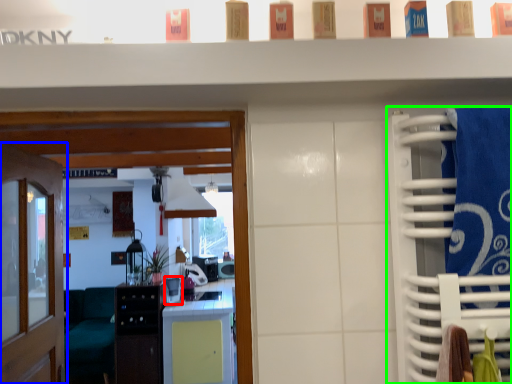
Question: Which object is positioned closest to appliance (highlighted by a red box)? Select from door (highlighted by a blue box) and closet (highlighted by a green box).

Choices:
 (A) door
 (B) closet

Answer: (A)